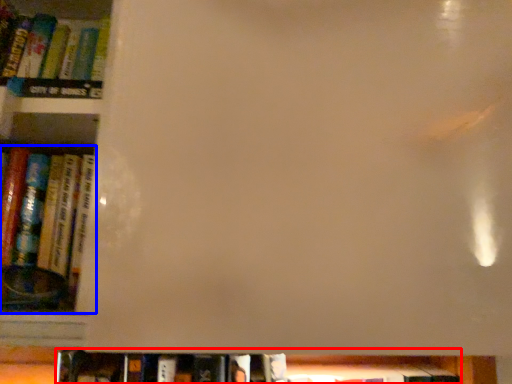
Question: Which point is further to the camera, book (highlighted by a red box) or book (highlighted by a blue box)?

Choices:
 (A) book
 (B) book

Answer: (A)